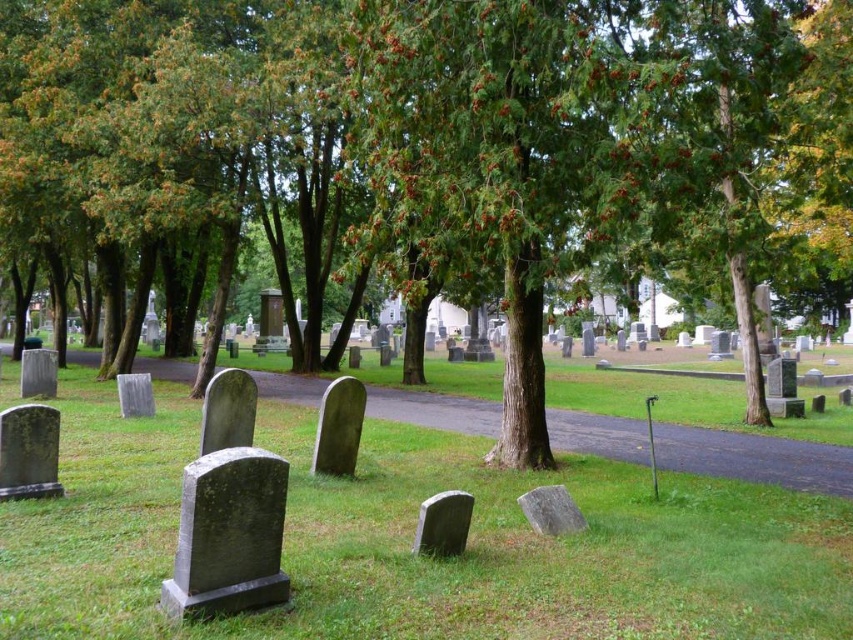
Is black stone gravestone at lower left bigger than gray stone gravestone at center?

Yes.

Which is behind, point (201, 528) or point (120, 390)?

The point (120, 390) is more distant.

Does point (271, 560) come closer to viewer compared to point (138, 390)?

Yes.

Identify the location of black stone gravestone at lower left. (228, 536).

This screenshot has height=640, width=853. Identify the location of black stone gravestone at lower left. (228, 536).

Based on the photo, is black stone gravestone at lower left taller than smooth gray gravestone at lower left?

Indeed, black stone gravestone at lower left has a greater height compared to smooth gray gravestone at lower left.

Locate an element on the screen. The width and height of the screenshot is (853, 640). black stone gravestone at lower left is located at coordinates (228, 536).

Does green grassy at center have a lesser width compared to smooth gray gravestone at center?

Incorrect, green grassy at center's width is not less than smooth gray gravestone at center's.

Is green grassy at center to the left of smooth gray gravestone at center from the viewer's perspective?

Indeed, green grassy at center is positioned on the left side of smooth gray gravestone at center.

The image size is (853, 640). In order to click on green grassy at center in this screenshot , I will do `click(412, 538)`.

Identify the location of green grassy at center. (412, 538).